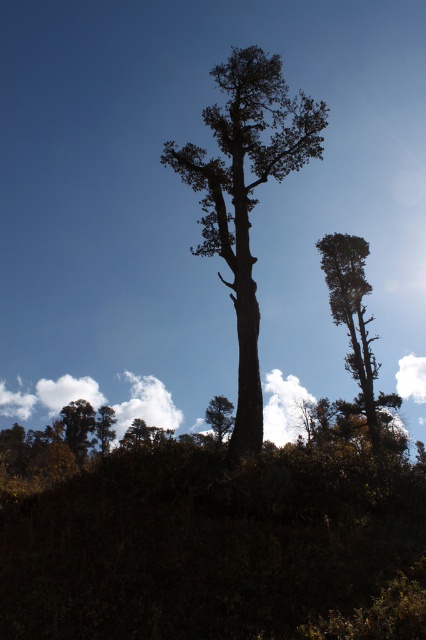
Question: Which object appears farthest from the camera in this image?

Choices:
 (A) green leafy tree at lower left
 (B) dark brown wood tree at center
 (C) smooth brown tree at upper right
 (D) green leafy vegetation at center

Answer: (A)

Question: Where is dark brown wood tree at center located in relation to green leafy tree at lower left in the image?

Choices:
 (A) left
 (B) right

Answer: (B)

Question: Can you confirm if smooth brown tree at upper right is positioned below green leafy tree at lower left?

Choices:
 (A) yes
 (B) no

Answer: (B)

Question: Can you confirm if green leafy vegetation at center is positioned above green matte tree at lower left?

Choices:
 (A) no
 (B) yes

Answer: (B)

Question: Which object appears closest to the camera in this image?

Choices:
 (A) smooth brown tree at upper right
 (B) green leafy vegetation at center
 (C) green matte tree at lower left

Answer: (B)

Question: Among these objects, which one is nearest to the camera?

Choices:
 (A) dark brown wood tree at center
 (B) green matte tree at lower left

Answer: (A)